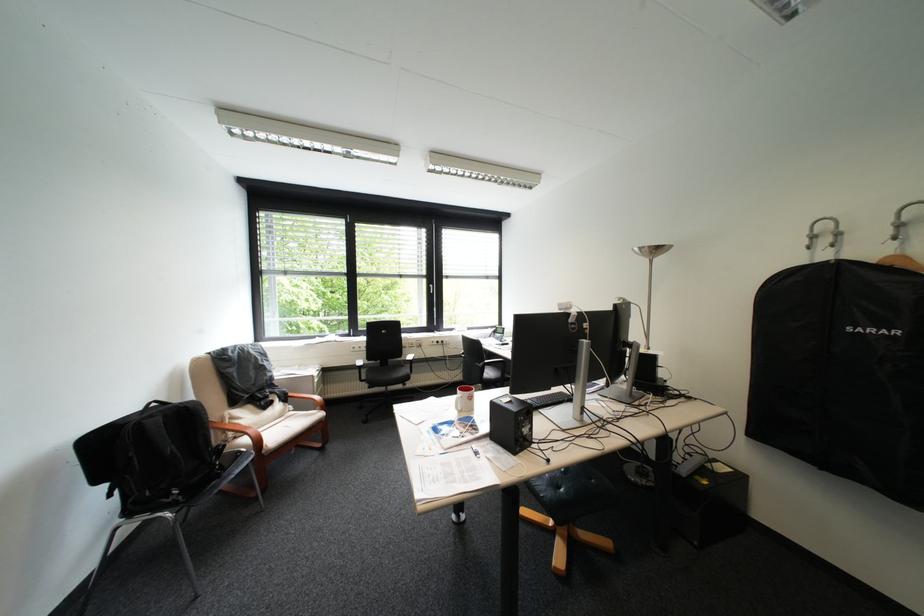
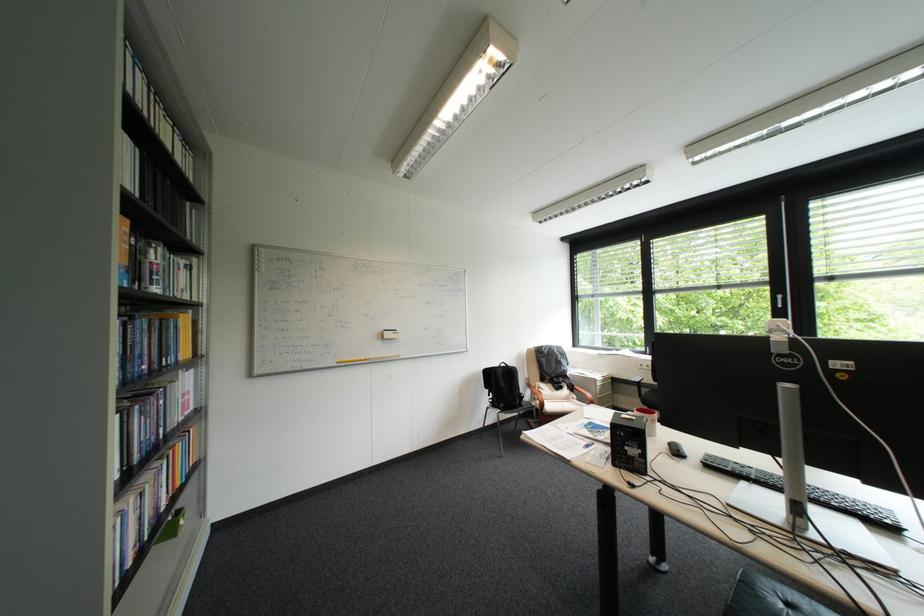
In the second image, find the point that corresponds to (x=553, y=411) in the first image.

(757, 484)